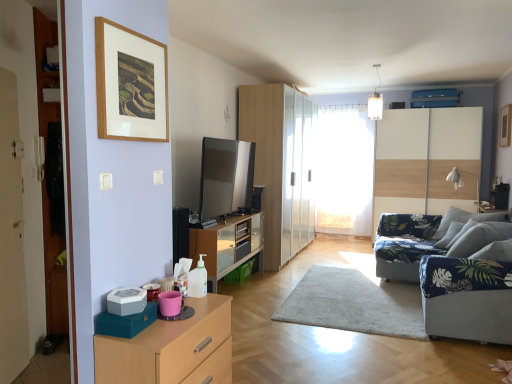
Question: Can you confirm if blue fabric armchair at right is positioned to the right of wooden picture frame at upper left, which is the 2th picture frame in right-to-left order?

Choices:
 (A) no
 (B) yes

Answer: (B)

Question: Can you confirm if blue fabric armchair at right is thinner than wooden picture frame at upper left, which is the 2th picture frame in right-to-left order?

Choices:
 (A) no
 (B) yes

Answer: (A)

Question: From the image's perspective, is blue fabric armchair at right beneath wooden picture frame at upper left, which is the second picture frame from back to front?

Choices:
 (A) yes
 (B) no

Answer: (A)

Question: Is blue fabric armchair at right looking in the opposite direction of wooden picture frame at upper left, which is the 2th picture frame in right-to-left order?

Choices:
 (A) yes
 (B) no

Answer: (B)

Question: Is blue fabric armchair at right closer to camera compared to wooden picture frame at upper left, which is the 2th picture frame in right-to-left order?

Choices:
 (A) yes
 (B) no

Answer: (B)

Question: Does blue fabric armchair at right have a larger size compared to wooden picture frame at upper left, arranged as the first picture frame when viewed from the front?

Choices:
 (A) yes
 (B) no

Answer: (A)

Question: Can you confirm if wooden picture frame at upper left, which is the second picture frame from back to front, is positioned to the right of blue fabric couch at right?

Choices:
 (A) no
 (B) yes

Answer: (A)

Question: From a real-world perspective, is wooden picture frame at upper left, which is the second picture frame from back to front, located beneath blue fabric couch at right?

Choices:
 (A) no
 (B) yes

Answer: (A)

Question: Is wooden picture frame at upper left, arranged as the first picture frame when viewed from the front, surrounding blue fabric couch at right?

Choices:
 (A) yes
 (B) no

Answer: (B)

Question: Is wooden picture frame at upper left, acting as the 1th picture frame starting from the left, positioned with its back to blue fabric couch at right?

Choices:
 (A) yes
 (B) no

Answer: (B)

Question: Is wooden picture frame at upper left, acting as the 1th picture frame starting from the left, positioned beyond the bounds of blue fabric couch at right?

Choices:
 (A) yes
 (B) no

Answer: (A)

Question: Could you tell me if wooden picture frame at upper left, which is the 2th picture frame in right-to-left order, is turned towards blue fabric couch at right?

Choices:
 (A) no
 (B) yes

Answer: (A)

Question: Can you confirm if transparent glass wardrobe at center is wider than light wood/wooden chest of drawers at lower left?

Choices:
 (A) no
 (B) yes

Answer: (A)